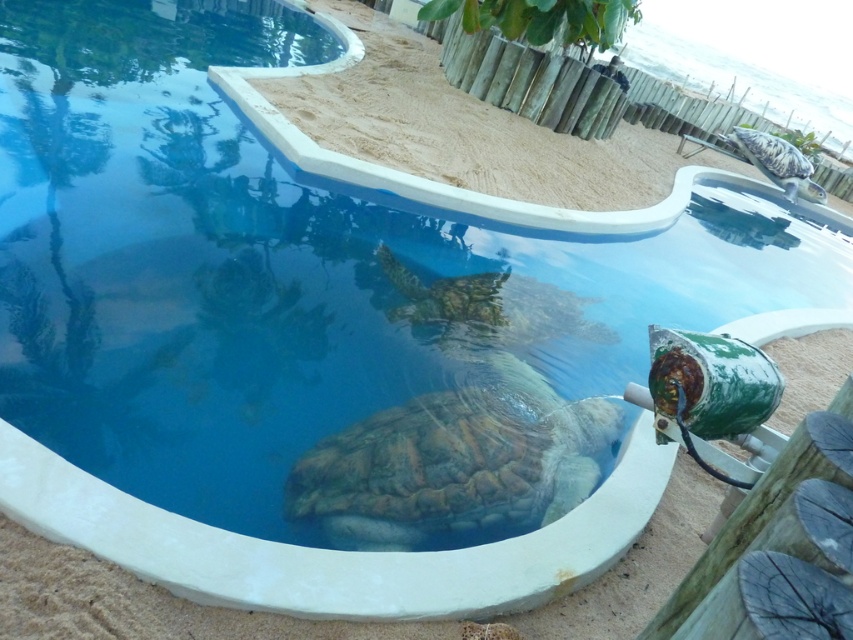
Question: Can you confirm if brown textured shell at center is positioned above green scaly tortoise at upper right?

Choices:
 (A) yes
 (B) no

Answer: (B)

Question: Which is farther from the green scaly tortoise at upper right?

Choices:
 (A) textured brown tortoise at center
 (B) brown textured shell at center

Answer: (B)

Question: Can you confirm if brown textured shell at center is positioned above green scaly tortoise at upper right?

Choices:
 (A) no
 (B) yes

Answer: (A)

Question: From the image, what is the correct spatial relationship of textured brown tortoise at center in relation to green scaly tortoise at upper right?

Choices:
 (A) above
 (B) below

Answer: (B)

Question: Based on their relative distances, which object is nearer to the green scaly tortoise at upper right?

Choices:
 (A) brown textured shell at center
 (B) textured brown tortoise at center

Answer: (B)

Question: Considering the real-world distances, which object is farthest from the green scaly tortoise at upper right?

Choices:
 (A) textured brown tortoise at center
 (B) brown textured shell at center

Answer: (B)